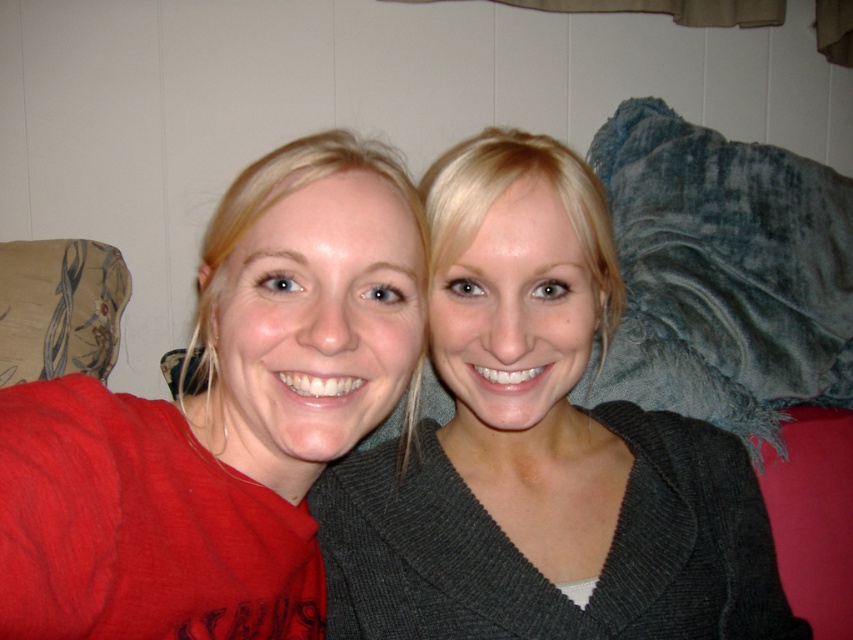
Is point (622, 502) positioned after point (146, 532)?

Yes, it is.

Can you confirm if matte gray sweater at center is thinner than red matte shirt at left?

No, matte gray sweater at center is not thinner than red matte shirt at left.

I want to click on matte gray sweater at center, so click(540, 448).

What do you see at coordinates (223, 419) in the screenshot? I see `red matte shirt at left` at bounding box center [223, 419].

Who is more distant from viewer, (138, 420) or (99, 360)?

Positioned behind is point (99, 360).

At what (x,y) coordinates should I click in order to perform the action: click on red matte shirt at left. Please return your answer as a coordinate pair (x, y). This screenshot has height=640, width=853. Looking at the image, I should click on 223,419.

Who is shorter, matte gray sweater at center or floral fabric pillow at left?

With less height is floral fabric pillow at left.

Is point (468, 412) farther from camera compared to point (68, 307)?

No, it is in front of (68, 307).

The image size is (853, 640). Identify the location of matte gray sweater at center. (540, 448).